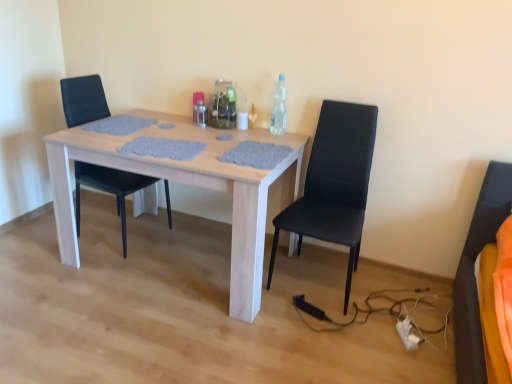
Question: Looking at the image, does clear plastic bottle at upper right, arranged as the third bottle when viewed from the left, seem bigger or smaller compared to black leather chair at center, the 1th chair viewed from the left?

Choices:
 (A) big
 (B) small

Answer: (B)

Question: From their relative heights in the image, would you say clear plastic bottle at upper right, arranged as the third bottle when viewed from the left, is taller or shorter than black leather chair at center, the 1th chair viewed from the left?

Choices:
 (A) short
 (B) tall

Answer: (A)

Question: Which of these objects is positioned farthest from the light wood table at center?

Choices:
 (A) clear glass bottle at center, the 2th bottle from the left
 (B) clear plastic bottle at upper right, placed as the 1th bottle when sorted from right to left
 (C) black leather chair at right, which is counted as the 1th chair, starting from the right
 (D) white fabric extension cord at lower right
 (E) black leather chair at center, marked as the second chair in a right-to-left arrangement

Answer: (D)

Question: Which is nearer to the white fabric extension cord at lower right?

Choices:
 (A) light wood table at center
 (B) metallic silver bottle at center, arranged as the first bottle when viewed from the left
 (C) black leather chair at center, marked as the second chair in a right-to-left arrangement
 (D) clear glass bottle at center, the 2th bottle from the left
 (E) clear plastic bottle at upper right, placed as the 1th bottle when sorted from right to left

Answer: (A)